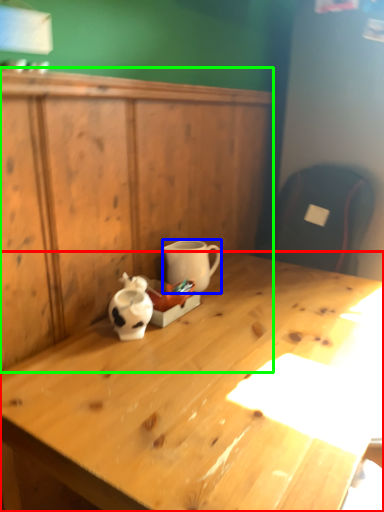
Question: Which is nearer to the desk (highlighted by a red box)? coffee cup (highlighted by a blue box) or dresser (highlighted by a green box).

Choices:
 (A) coffee cup
 (B) dresser

Answer: (A)